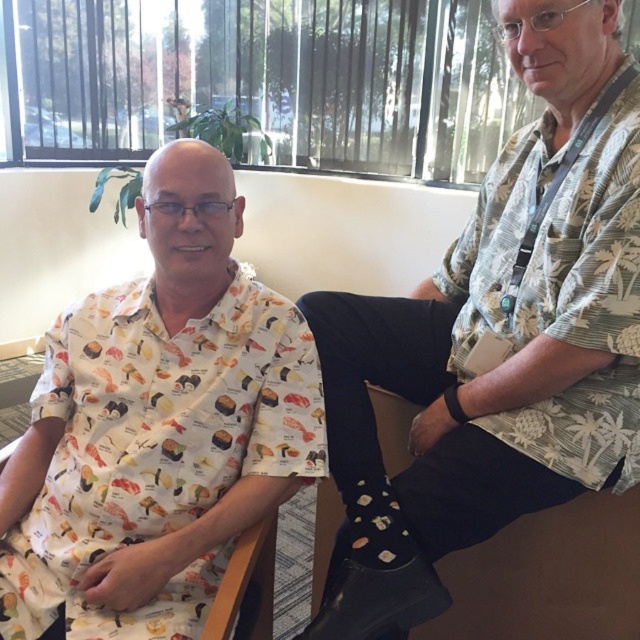
Between white palm print shirt at center and green palm tree print shirt at upper right, which one has more height?

Standing taller between the two is white palm print shirt at center.

Measure the distance from white palm print shirt at center to green palm tree print shirt at upper right.

white palm print shirt at center and green palm tree print shirt at upper right are 2.27 inches apart from each other.

At what (x,y) coordinates should I click in order to perform the action: click on white palm print shirt at center. Please return your answer as a coordinate pair (x, y). Looking at the image, I should click on (496, 337).

Where is `white palm print shirt at center`? This screenshot has height=640, width=640. white palm print shirt at center is located at coordinates (496, 337).

Consider the image. Who is more distant from viewer, (305, 380) or (216, 614)?

The point (305, 380) is more distant.

Is point (225, 362) less distant than point (250, 528)?

No, it is not.

Locate an element on the screen. white printed shirt at center is located at coordinates coord(157,426).

Does white palm print shirt at center appear over wooden chair at center?

Yes, white palm print shirt at center is above wooden chair at center.

Which is below, white palm print shirt at center or wooden chair at center?

wooden chair at center is below.

This screenshot has width=640, height=640. What do you see at coordinates (496, 337) in the screenshot?
I see `white palm print shirt at center` at bounding box center [496, 337].

You are a GUI agent. You are given a task and a screenshot of the screen. Output one action in this format:
    pyautogui.click(x=<x>, y=<y>)
    Task: Click on the white palm print shirt at center
    
    Given the screenshot: What is the action you would take?
    pyautogui.click(x=496, y=337)